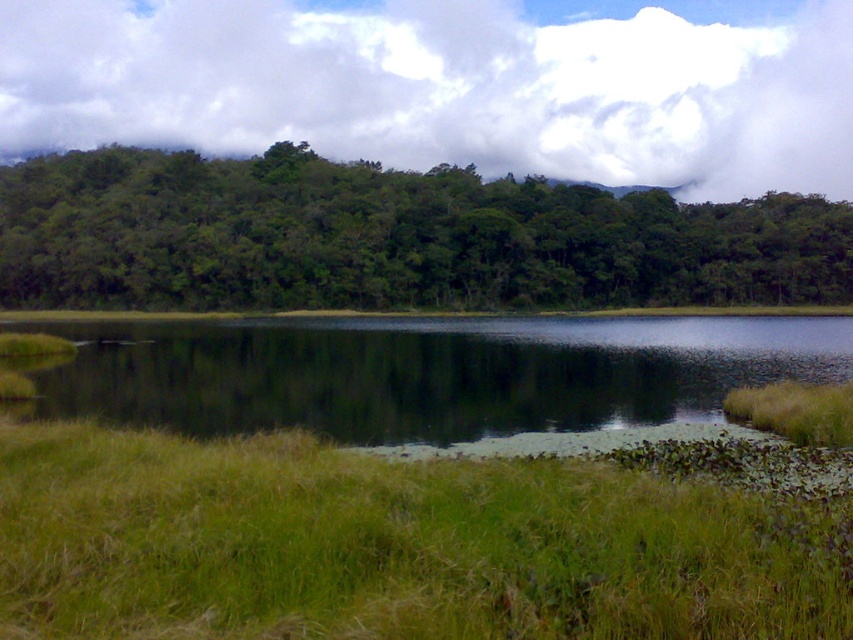
Does white fluffy cloud at upper center have a lesser width compared to green leafy trees at upper center?

No.

Locate an element on the screen. This screenshot has width=853, height=640. white fluffy cloud at upper center is located at coordinates (450, 84).

Is green grassy at lower center to the left of green leafy trees at upper center from the viewer's perspective?

Indeed, green grassy at lower center is positioned on the left side of green leafy trees at upper center.

Is point (25, 608) farther from camera compared to point (628, 304)?

No, it is not.

The width and height of the screenshot is (853, 640). I want to click on green grassy at lower center, so click(x=390, y=547).

Can you confirm if green grassy at lower center is smaller than white fluffy cloud at upper center?

Yes, green grassy at lower center is smaller than white fluffy cloud at upper center.

Is green grassy at lower center taller than white fluffy cloud at upper center?

In fact, green grassy at lower center may be shorter than white fluffy cloud at upper center.

Is point (489, 518) positioned before point (463, 141)?

That is True.

You are a GUI agent. You are given a task and a screenshot of the screen. Output one action in this format:
    pyautogui.click(x=<x>, y=<y>)
    Task: Click on the green grassy at lower center
    This screenshot has width=853, height=640.
    Given the screenshot: What is the action you would take?
    pyautogui.click(x=390, y=547)